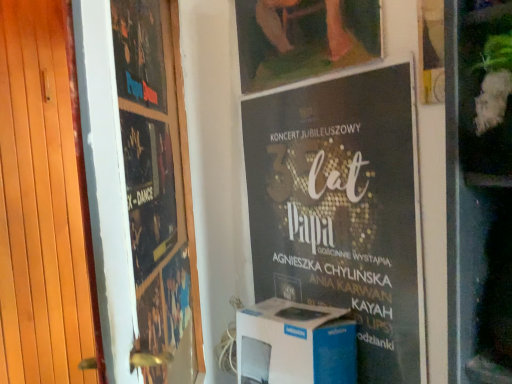
This screenshot has width=512, height=384. In order to click on matte black poster at left, placed as the 2th poster when sorted from left to right in this screenshot , I will do `click(158, 185)`.

In order to face matte black poster at left, placed as the 2th poster when sorted from left to right, should I rotate leftwards or rightwards?

Rotate your view left by about 11.803°.

Describe the element at coordinates (342, 210) in the screenshot. I see `black paper poster at center, placed as the third poster when sorted from left to right` at that location.

At what (x,y) coordinates should I click in order to perform the action: click on white cardboard box at center. Please return your answer as a coordinate pair (x, y). This screenshot has width=512, height=384. Looking at the image, I should click on (295, 344).

From the picture: What is the approximate width of matte wooden picture frame at upper center?

matte wooden picture frame at upper center is 0.68 inches wide.

Find the location of a particular element. matte black poster at left, which is the second poster from right to left is located at coordinates (158, 185).

In order to click on the 2nd poster below the matte wooden picture frame at upper center (from the image's perspective) in this screenshot , I will do [158, 185].

From the image's perspective, is matte black poster at left, placed as the 2th poster when sorted from left to right, positioned above or below matte wooden picture frame at upper center?

matte black poster at left, placed as the 2th poster when sorted from left to right, is situated lower than matte wooden picture frame at upper center in the image.

Is point (140, 288) closer or farther from the camera than point (340, 22)?

Clearly, point (140, 288) is closer to the camera than point (340, 22).

From a real-world perspective, who is located higher, matte black poster at upper left, placed as the first poster when sorted from left to right, or white cardboard box at center?

matte black poster at upper left, placed as the first poster when sorted from left to right, from a real-world perspective.

Is point (130, 43) positioned behind point (331, 309)?

No, it is in front of (331, 309).

Is matte black poster at upper left, the third poster positioned from the right, not inside white cardboard box at center?

Absolutely, matte black poster at upper left, the third poster positioned from the right, is external to white cardboard box at center.

Is matte black poster at upper left, placed as the first poster when sorted from left to right, far from white cardboard box at center?

No, matte black poster at upper left, placed as the first poster when sorted from left to right, is not far away from white cardboard box at center.

Image resolution: width=512 pixels, height=384 pixels. Find the location of `appliance located underneath the matte wooden picture frame at upper center (from a real-world perspective)`. appliance located underneath the matte wooden picture frame at upper center (from a real-world perspective) is located at coordinates tap(295, 344).

Does point (279, 343) come in front of point (308, 44)?

Yes, it is.

From the image's perspective, relative to matte wooden picture frame at upper center, is white cardboard box at center above or below?

Based on their image positions, white cardboard box at center is located beneath matte wooden picture frame at upper center.

Who is smaller, matte black poster at upper left, placed as the first poster when sorted from left to right, or matte black poster at left, placed as the 2th poster when sorted from left to right?

Smaller between the two is matte black poster at upper left, placed as the first poster when sorted from left to right.

From the image's perspective, which one is positioned lower, matte black poster at upper left, placed as the first poster when sorted from left to right, or matte black poster at left, placed as the 2th poster when sorted from left to right?

matte black poster at left, placed as the 2th poster when sorted from left to right, is shown below in the image.

Which object is positioned more to the left, matte black poster at upper left, the third poster positioned from the right, or matte black poster at left, which is the second poster from right to left?

matte black poster at upper left, the third poster positioned from the right, is more to the left.

Consider the image. Considering the sizes of objects matte black poster at upper left, placed as the first poster when sorted from left to right, and matte black poster at left, which is the second poster from right to left, in the image provided, who is wider, matte black poster at upper left, placed as the first poster when sorted from left to right, or matte black poster at left, which is the second poster from right to left,?

matte black poster at left, which is the second poster from right to left, is wider.

The width and height of the screenshot is (512, 384). In order to click on the 2nd poster positioned below the matte black poster at upper left, placed as the first poster when sorted from left to right (from a real-world perspective) in this screenshot , I will do `click(342, 210)`.

Does point (136, 29) lie behind point (331, 281)?

That is False.

Consider the image. Is matte black poster at upper left, the third poster positioned from the right, positioned beyond the bounds of black paper poster at center, which appears as the 1th poster when viewed from the right?

Yes.

From the image's perspective, is matte black poster at upper left, the third poster positioned from the right, beneath black paper poster at center, placed as the third poster when sorted from left to right?

Incorrect, from the image's perspective, matte black poster at upper left, the third poster positioned from the right, is higher than black paper poster at center, placed as the third poster when sorted from left to right.

Is matte wooden picture frame at upper center facing towards matte black poster at left, which is the second poster from right to left?

Yes, matte wooden picture frame at upper center is oriented towards matte black poster at left, which is the second poster from right to left.

Considering the sizes of matte wooden picture frame at upper center and matte black poster at left, which is the second poster from right to left, in the image, is matte wooden picture frame at upper center taller or shorter than matte black poster at left, which is the second poster from right to left,?

In the image, matte wooden picture frame at upper center appears to be shorter than matte black poster at left, which is the second poster from right to left.

From the image's perspective, is matte wooden picture frame at upper center above or below matte black poster at left, which is the second poster from right to left?

Based on their image positions, matte wooden picture frame at upper center is located above matte black poster at left, which is the second poster from right to left.

Does point (326, 3) appear closer or farther from the camera than point (172, 120)?

Point (326, 3) is closer to the camera than point (172, 120).

Is white cardboard box at center bigger or smaller than matte black poster at left, placed as the 2th poster when sorted from left to right?

In the image, white cardboard box at center appears to be smaller than matte black poster at left, placed as the 2th poster when sorted from left to right.

From the image's perspective, would you say white cardboard box at center is shown under matte black poster at left, placed as the 2th poster when sorted from left to right?

Yes.

How far apart are white cardboard box at center and matte black poster at left, which is the second poster from right to left?

A distance of 17.02 inches exists between white cardboard box at center and matte black poster at left, which is the second poster from right to left.

This screenshot has height=384, width=512. I want to click on picture frame that is above the matte black poster at left, placed as the 2th poster when sorted from left to right (from a real-world perspective), so [x=303, y=39].

Identify the location of the 2nd poster in front of the white cardboard box at center. The height and width of the screenshot is (384, 512). (139, 52).

In the scene shown: Estimate the real-world distances between objects in this image. Which object is further from black paper poster at center, which appears as the 1th poster when viewed from the right, matte black poster at upper left, placed as the first poster when sorted from left to right, or white cardboard box at center?

matte black poster at upper left, placed as the first poster when sorted from left to right, is further to black paper poster at center, which appears as the 1th poster when viewed from the right.

From the image, which object appears to be farther from matte black poster at left, which is the second poster from right to left, matte black poster at upper left, the third poster positioned from the right, or black paper poster at center, which appears as the 1th poster when viewed from the right?

black paper poster at center, which appears as the 1th poster when viewed from the right, is positioned further to the anchor matte black poster at left, which is the second poster from right to left.

From the picture: Based on their spatial positions, is matte black poster at upper left, placed as the first poster when sorted from left to right, or white cardboard box at center further from matte black poster at left, placed as the 2th poster when sorted from left to right?

white cardboard box at center lies further to matte black poster at left, placed as the 2th poster when sorted from left to right, than the other object.

From the image, which object appears to be nearer to white cardboard box at center, matte black poster at left, placed as the 2th poster when sorted from left to right, or matte wooden picture frame at upper center?

matte black poster at left, placed as the 2th poster when sorted from left to right, lies closer to white cardboard box at center than the other object.

Based on their spatial positions, is matte wooden picture frame at upper center or white cardboard box at center further from matte black poster at upper left, placed as the first poster when sorted from left to right?

white cardboard box at center is further to matte black poster at upper left, placed as the first poster when sorted from left to right.

From the picture: Based on their spatial positions, is matte wooden picture frame at upper center or wooden at left closer to white cardboard box at center?

Among the two, matte wooden picture frame at upper center is located nearer to white cardboard box at center.

Looking at the image, which one is located closer to matte black poster at left, which is the second poster from right to left, wooden at left or black paper poster at center, placed as the third poster when sorted from left to right?

Based on the image, black paper poster at center, placed as the third poster when sorted from left to right, appears to be nearer to matte black poster at left, which is the second poster from right to left.

Based on their spatial positions, is white cardboard box at center or black paper poster at center, which appears as the 1th poster when viewed from the right, further from matte wooden picture frame at upper center?

Among the two, white cardboard box at center is located further to matte wooden picture frame at upper center.

I want to click on appliance between wooden at left and black paper poster at center, placed as the third poster when sorted from left to right, in the horizontal direction, so click(295, 344).

You are a GUI agent. You are given a task and a screenshot of the screen. Output one action in this format:
    pyautogui.click(x=<x>, y=<y>)
    Task: Click on the door between matte black poster at upper left, placed as the first poster when sorted from left to right, and white cardboard box at center vertically
    The width and height of the screenshot is (512, 384).
    Given the screenshot: What is the action you would take?
    pyautogui.click(x=44, y=201)

Find the location of a particular element. The height and width of the screenshot is (384, 512). picture frame between wooden at left and black paper poster at center, placed as the third poster when sorted from left to right, in the horizontal direction is located at coordinates (303, 39).

Locate an element on the screen. This screenshot has width=512, height=384. door between matte black poster at upper left, placed as the first poster when sorted from left to right, and matte black poster at left, placed as the 2th poster when sorted from left to right, vertically is located at coordinates (44, 201).